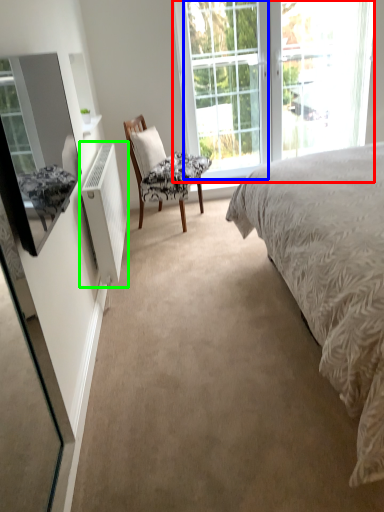
Question: Considering the real-world distances, which object is farthest from window (highlighted by a red box)? glass door (highlighted by a blue box) or radiator (highlighted by a green box)?

Choices:
 (A) glass door
 (B) radiator

Answer: (B)